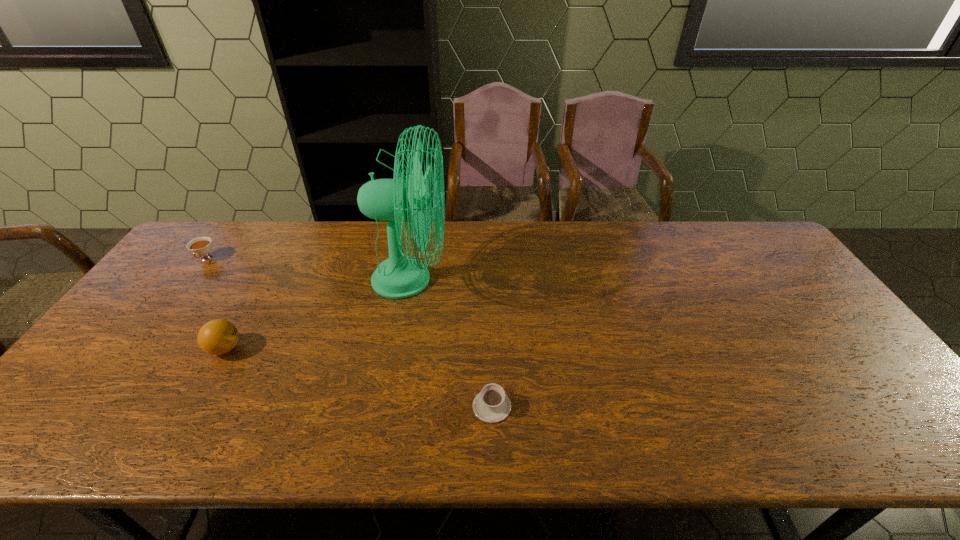
In the image, there is a desktop. Identify the location of vacant area at the near edge. This screenshot has width=960, height=540. (803, 431).

At what (x,y) coordinates should I click in order to perform the action: click on vacant area at the left edge. Please return your answer as a coordinate pair (x, y). Looking at the image, I should click on (x=102, y=412).

Find the location of a particular element. vacant space at the far left corner is located at coordinates (214, 238).

Where is `free region at the far right corner`? This screenshot has height=540, width=960. free region at the far right corner is located at coordinates [747, 260].

The height and width of the screenshot is (540, 960). Identify the location of empty space that is in between the third object from left to right and the second object from left to right. (318, 314).

Identify the location of unoccupied area between the right teacup and the fan. (451, 343).

Find the location of a particular element. Image resolution: width=960 pixels, height=540 pixels. free space between the fan and the shortest object is located at coordinates (451, 343).

Identify the location of empty location between the third object from left to right and the ping-pong ball. The height and width of the screenshot is (540, 960). (318, 314).

Find the location of a particular element. This screenshot has width=960, height=540. free space between the third shortest object and the right teacup is located at coordinates (358, 377).

I want to click on free area in between the third object from left to right and the ping-pong ball, so click(318, 314).